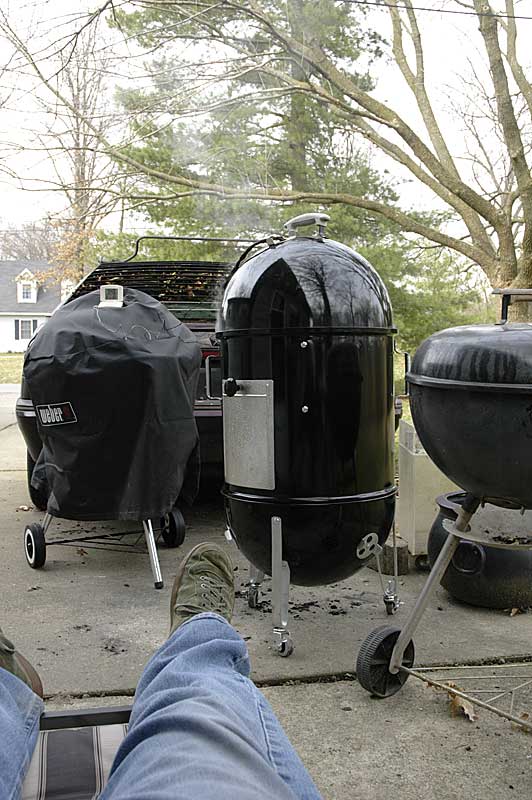
This screenshot has width=532, height=800. I want to click on handle on right side of middle grill, so click(406, 360).